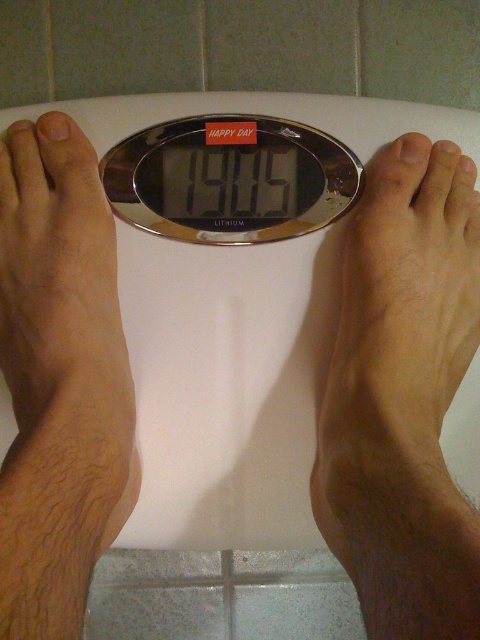
You are a photographer taking a picture of the digital bathroom scale. You notice two points on the scale labeled as point (24, 132) and point (228, 170). Which point will appear larger in the photo?

Point (24, 132) is closer to the camera than point (228, 170), so it will appear larger in the photo.

You are a health app developer analyzing a bathroom scene. You need to determine if the smooth skin foot at left can fully cover the silver metallic scale at center based on their sizes. What do you conclude?

The smooth skin foot at left is larger in size than the silver metallic scale at center, so it can fully cover the silver metallic scale at center.

Based on the photo, you are a physical therapist advising a patient on proper scale usage. The patient wants to ensure their foot placement is correct. Based on the scene, which object is positioned closer to you when observing the smooth skin foot at left and the silver metallic scale at center?

The smooth skin foot at left is closer to the viewer than the silver metallic scale at center, so the foot is positioned closer when observing.